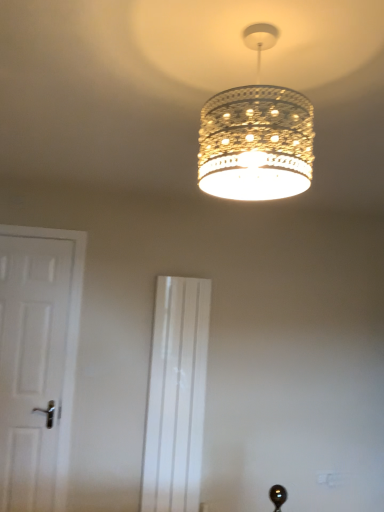
Identify the location of white glossy screen door at center. (176, 395).

Locate an element on the screen. The width and height of the screenshot is (384, 512). white matte door at left is located at coordinates (32, 366).

Find the location of a particular element. The height and width of the screenshot is (512, 384). white glossy screen door at center is located at coordinates click(176, 395).

Find the location of a particular element. The image size is (384, 512). screen door that is below the clear glass chandelier at upper center (from the image's perspective) is located at coordinates (176, 395).

Is clear glass chandelier at upper center located outside white glossy screen door at center?

clear glass chandelier at upper center is positioned outside white glossy screen door at center.

Considering the relative sizes of clear glass chandelier at upper center and white glossy screen door at center in the image provided, is clear glass chandelier at upper center shorter than white glossy screen door at center?

Correct, clear glass chandelier at upper center is not as tall as white glossy screen door at center.

Identify the location of door below the clear glass chandelier at upper center (from the image's perspective). 32,366.

Is clear glass chandelier at upper center to the left or to the right of white matte door at left in the image?

In the image, clear glass chandelier at upper center appears on the right side of white matte door at left.

Do you think clear glass chandelier at upper center is within white matte door at left, or outside of it?

clear glass chandelier at upper center is not inside white matte door at left, it's outside.

Is clear glass chandelier at upper center taller than white matte door at left?

Incorrect, the height of clear glass chandelier at upper center is not larger of that of white matte door at left.

Does white matte door at left turn towards clear glass chandelier at upper center?

No, white matte door at left is not turned towards clear glass chandelier at upper center.

From the picture: Would you say white matte door at left is a long distance from clear glass chandelier at upper center?

That's right, there is a large distance between white matte door at left and clear glass chandelier at upper center.

Between white matte door at left and clear glass chandelier at upper center, which one has smaller size?

Smaller between the two is clear glass chandelier at upper center.

Is point (42, 397) closer to viewer compared to point (240, 132)?

No, it is behind (240, 132).

How different are the orientations of white glossy screen door at center and white matte door at left in degrees?

There is a 0.0816-degree angle between the facing directions of white glossy screen door at center and white matte door at left.

Considering the sizes of objects white glossy screen door at center and white matte door at left in the image provided, who is smaller, white glossy screen door at center or white matte door at left?

Smaller between the two is white glossy screen door at center.

Which is more to the right, white glossy screen door at center or white matte door at left?

Positioned to the right is white glossy screen door at center.

Between white glossy screen door at center and white matte door at left, which one has larger width?

With larger width is white matte door at left.

Consider the image. How different are the orientations of white matte door at left and white glossy screen door at center in degrees?

There is a 0.0816-degree angle between the facing directions of white matte door at left and white glossy screen door at center.

From a real-world perspective, between white matte door at left and white glossy screen door at center, who is vertically higher?

In real-world perspective, white matte door at left is above.

Find the location of a particular element. This screenshot has height=512, width=384. screen door behind the white matte door at left is located at coordinates (176, 395).

Is white glossy screen door at center at the right side of clear glass chandelier at upper center?

No.

Between white glossy screen door at center and clear glass chandelier at upper center, which one has more height?

white glossy screen door at center.

From the image's perspective, is white glossy screen door at center beneath clear glass chandelier at upper center?

Yes.

Based on the photo, could you tell me if white glossy screen door at center is turned towards clear glass chandelier at upper center?

Yes.

This screenshot has width=384, height=512. In order to click on lamp that is on the right side of white glossy screen door at center in this screenshot , I will do `click(256, 136)`.

Find the location of `door below the clear glass chandelier at upper center (from a real-world perspective)`. door below the clear glass chandelier at upper center (from a real-world perspective) is located at coordinates (32, 366).

Looking at the image, which one is located further to white matte door at left, white glossy screen door at center or clear glass chandelier at upper center?

Among the two, clear glass chandelier at upper center is located further to white matte door at left.

From the image, which object appears to be farther from white glossy screen door at center, white matte door at left or clear glass chandelier at upper center?

Based on the image, clear glass chandelier at upper center appears to be further to white glossy screen door at center.

When comparing their distances from clear glass chandelier at upper center, does white glossy screen door at center or white matte door at left seem further?

The object further to clear glass chandelier at upper center is white matte door at left.

Looking at the image, which one is located closer to white matte door at left, clear glass chandelier at upper center or white glossy screen door at center?

Among the two, white glossy screen door at center is located nearer to white matte door at left.

Considering their positions, is clear glass chandelier at upper center positioned closer to white glossy screen door at center than white matte door at left?

Among the two, white matte door at left is located nearer to white glossy screen door at center.

Looking at this image, which object lies further to the anchor point clear glass chandelier at upper center, white matte door at left or white glossy screen door at center?

The object further to clear glass chandelier at upper center is white matte door at left.

This screenshot has height=512, width=384. What are the coordinates of `door between clear glass chandelier at upper center and white glossy screen door at center along the z-axis` in the screenshot? It's located at (32, 366).